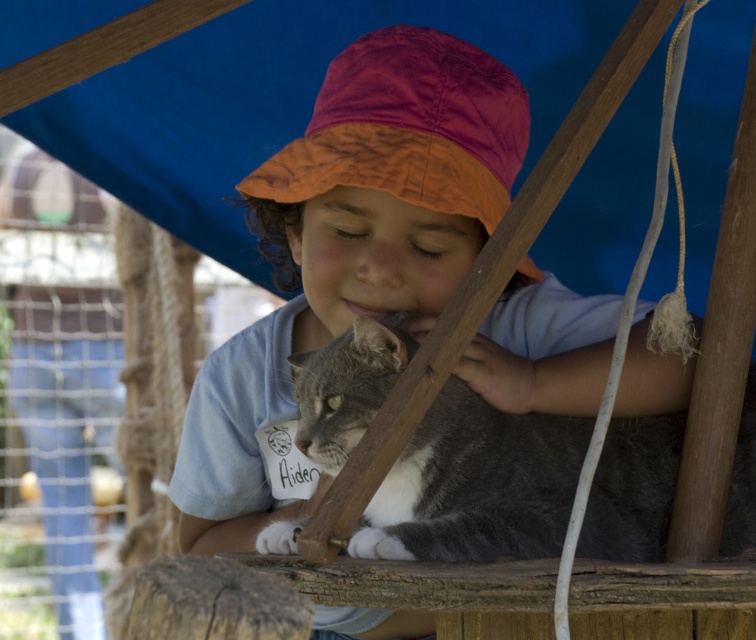
Question: Which point is farther to the camera?

Choices:
 (A) matte blue shirt at center
 (B) gray-furred cat at center

Answer: (A)

Question: Estimate the real-world distances between objects in this image. Which object is farther from the smooth gray cat at center?

Choices:
 (A) gray-furred cat at center
 (B) matte blue shirt at center

Answer: (A)

Question: Which object is the farthest from the gray-furred cat at center?

Choices:
 (A) smooth gray cat at center
 (B) matte blue shirt at center

Answer: (A)

Question: Can you confirm if gray-furred cat at center is smaller than smooth gray cat at center?

Choices:
 (A) yes
 (B) no

Answer: (A)

Question: Does matte blue shirt at center appear on the right side of gray-furred cat at center?

Choices:
 (A) no
 (B) yes

Answer: (A)

Question: Is gray-furred cat at center closer to the viewer compared to smooth gray cat at center?

Choices:
 (A) yes
 (B) no

Answer: (A)